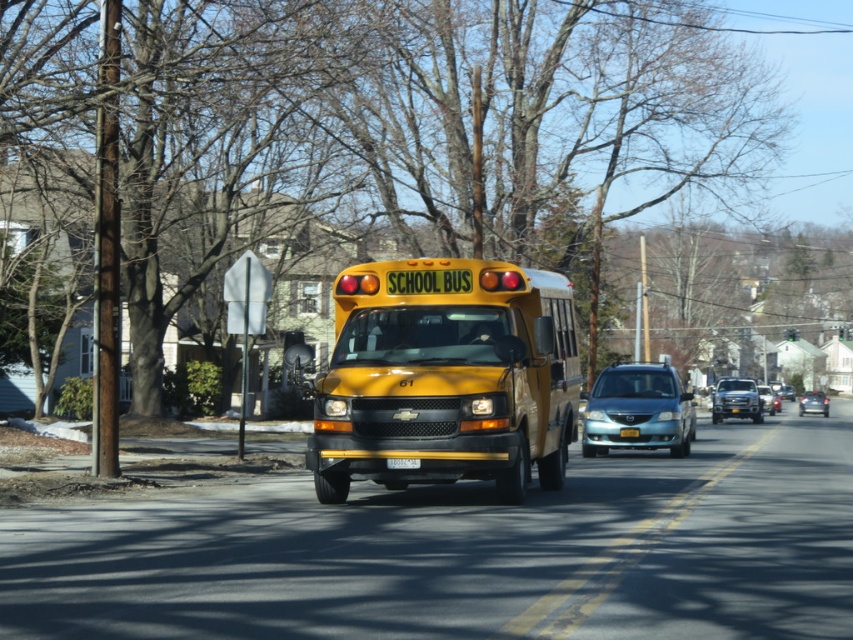
You are standing on the sidewalk next to the yellow school bus in the image. You notice two points marked on the road ahead. The first point is at coordinates point (752, 404) and the second is at point (827, 401). Which point is closer to your current position?

The point at (752, 404) is closer to your current position because it is closer to the viewer than the other point.

You are standing on the sidewalk next to the yellow school bus and want to throw a small ball to a friend. If you aim for the point at coordinates point (480, 260) and point (763, 401) on the bus, which point will the ball reach first?

The ball will reach point (480, 260) first because it is closer to you than point (763, 401).

You are a pedestrian standing on the sidewalk and see both the yellow matte school bus at center and the metallic blue sedan at center on the road. Which vehicle appears larger to you?

The metallic blue sedan at center appears larger because the yellow matte school bus at center has a smaller size compared to it.